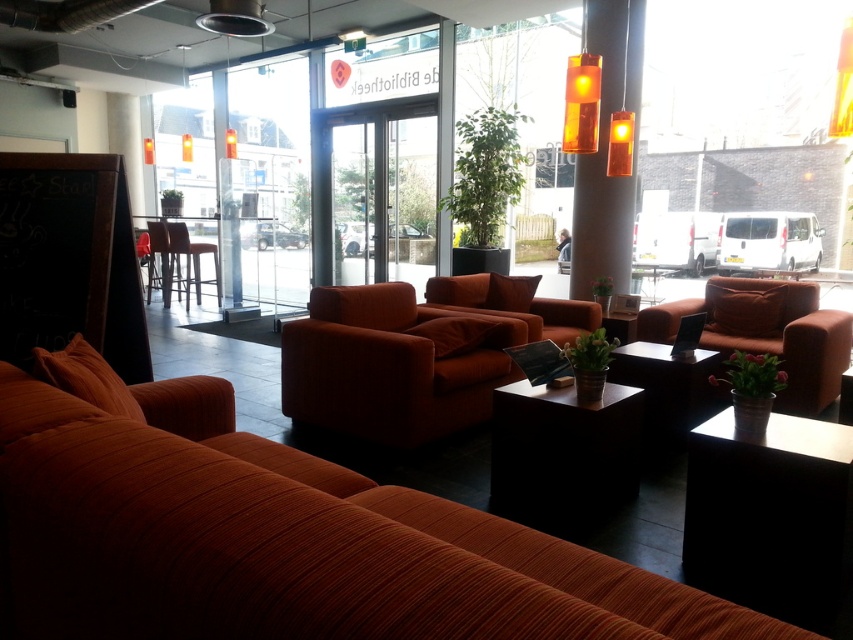
Where is `transparent glass door at center`? transparent glass door at center is located at coordinates (374, 193).

Image resolution: width=853 pixels, height=640 pixels. What do you see at coordinates (374, 193) in the screenshot?
I see `transparent glass door at center` at bounding box center [374, 193].

Is point (340, 236) less distant than point (790, 333)?

No.

Find the location of `transparent glass door at center`. transparent glass door at center is located at coordinates (374, 193).

Does transparent glass door at center appear over black matte table at center?

Yes.

Is transparent glass door at center behind black matte table at center?

Yes.

In order to click on transparent glass door at center in this screenshot , I will do `click(374, 193)`.

Can you confirm if matte orange armchair at center is positioned above brown leather bar stool at center?

No, matte orange armchair at center is not above brown leather bar stool at center.

Does matte orange armchair at center have a greater width compared to brown leather bar stool at center?

Correct, the width of matte orange armchair at center exceeds that of brown leather bar stool at center.

The width and height of the screenshot is (853, 640). Find the location of `matte orange armchair at center`. matte orange armchair at center is located at coordinates (767, 333).